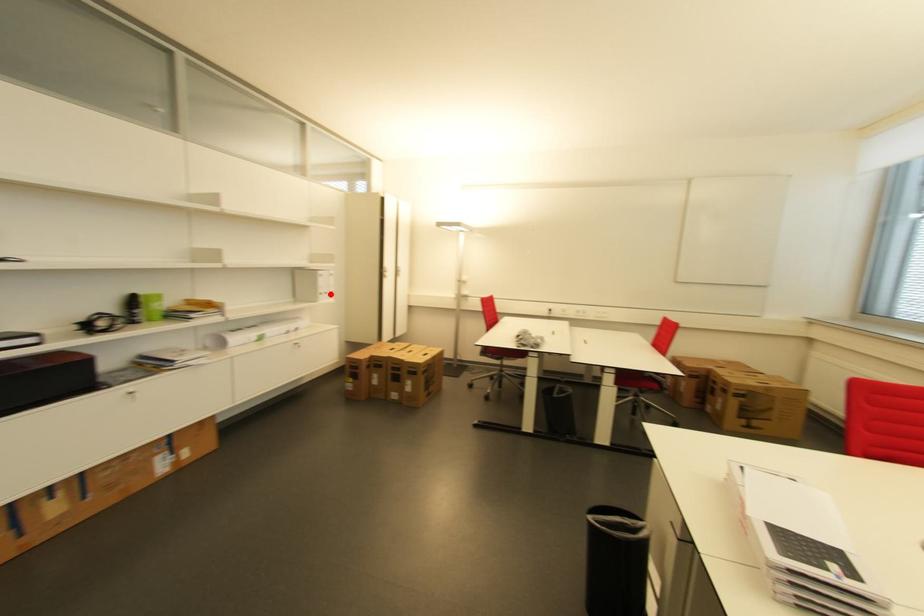
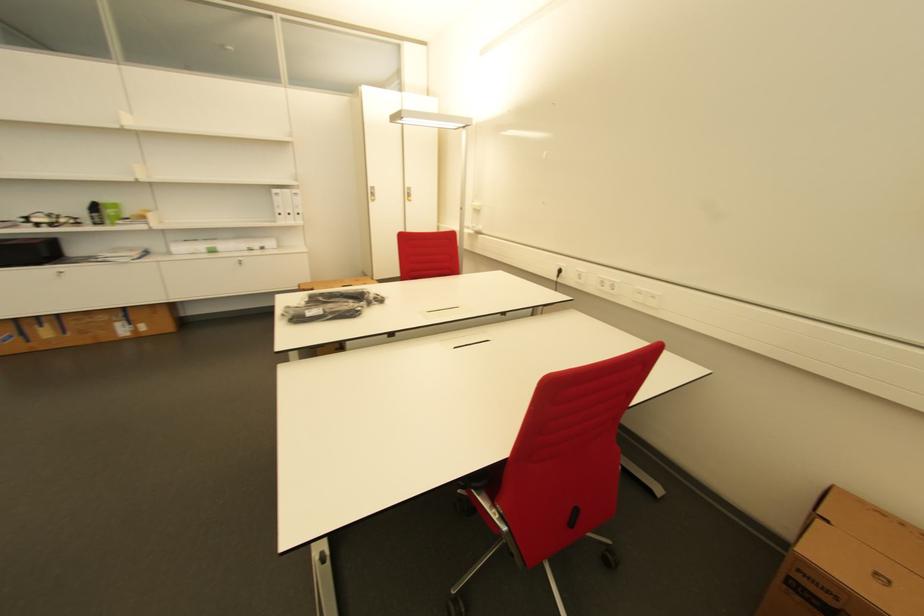
Locate, in the second image, the point that corresponds to the highlighted location in the first image.

(294, 216)